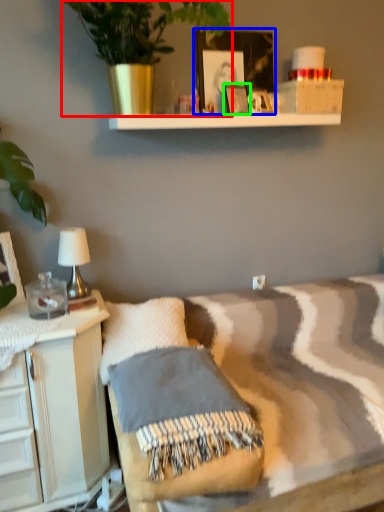
Question: Which is farther away from houseplant (highlighted by a red box)? picture frame (highlighted by a blue box) or picture frame (highlighted by a green box)?

Choices:
 (A) picture frame
 (B) picture frame

Answer: (B)